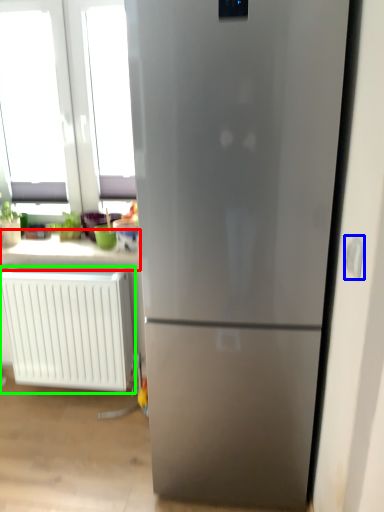
Question: Based on their relative distances, which object is nearer to counter top (highlighted by a red box)? Choose from electric outlet (highlighted by a blue box) and radiator (highlighted by a green box).

Choices:
 (A) electric outlet
 (B) radiator

Answer: (B)